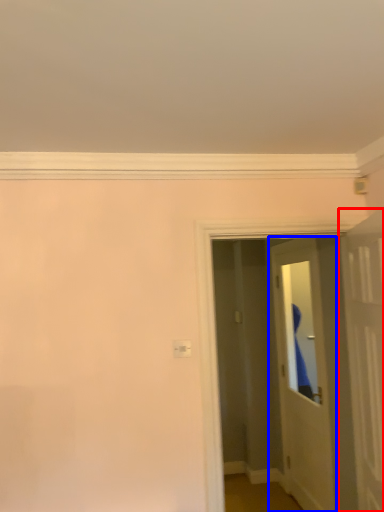
Question: Which object is closer to the camera taking this photo, door (highlighted by a red box) or door (highlighted by a blue box)?

Choices:
 (A) door
 (B) door

Answer: (A)